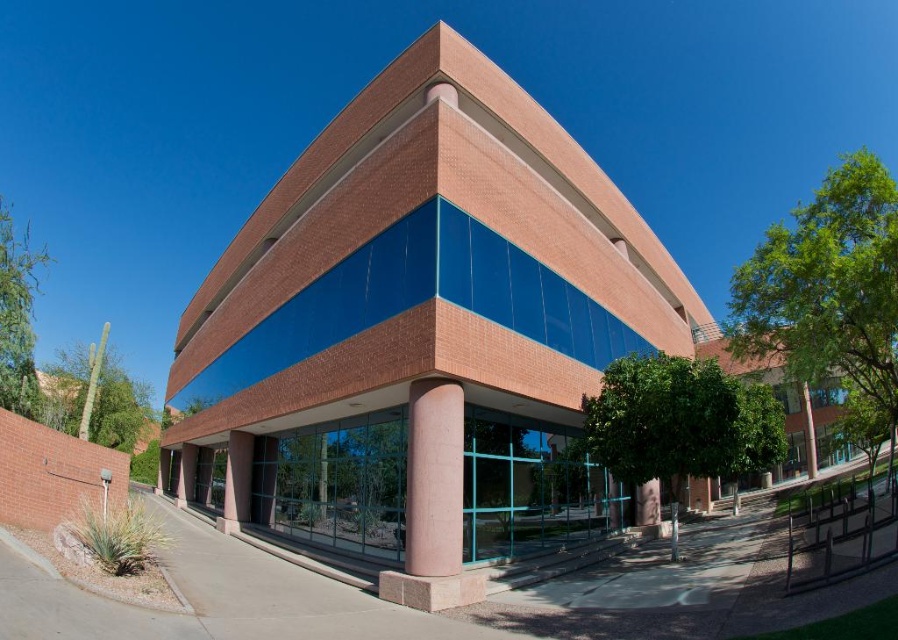
Question: Does pink concrete column at center lie behind smooth concrete pillar at lower center?

Choices:
 (A) no
 (B) yes

Answer: (A)

Question: Which of the following is the farthest from the observer?

Choices:
 (A) smooth concrete pillar at lower center
 (B) pink concrete column at center

Answer: (A)

Question: Which object appears closest to the camera in this image?

Choices:
 (A) smooth concrete pillar at lower center
 (B) pink concrete column at center

Answer: (B)

Question: Is pink concrete column at center thinner than smooth concrete pillar at lower center?

Choices:
 (A) yes
 (B) no

Answer: (A)

Question: In this image, where is pink concrete column at center located relative to smooth concrete pillar at lower center?

Choices:
 (A) below
 (B) above

Answer: (B)